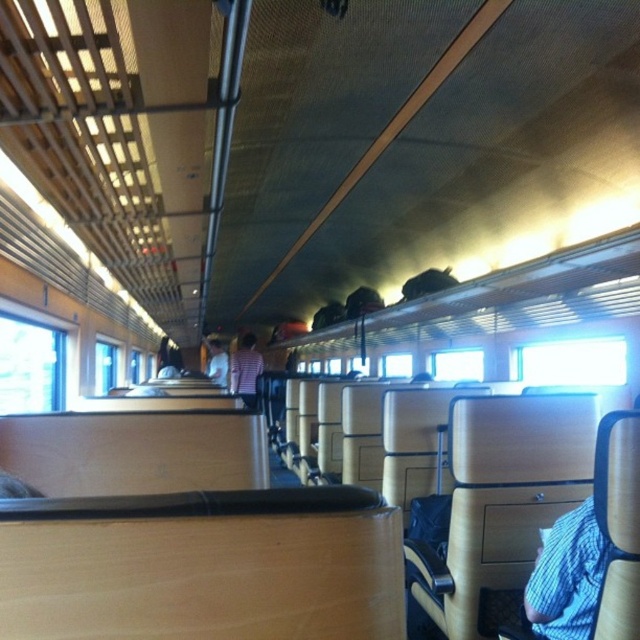
Is striped fabric shirt at center above white fabric shirt at center?

Indeed, striped fabric shirt at center is positioned over white fabric shirt at center.

Does striped fabric shirt at center have a lesser width compared to white fabric shirt at center?

Indeed, striped fabric shirt at center has a lesser width compared to white fabric shirt at center.

Is point (232, 355) farther from camera compared to point (221, 374)?

No, it is in front of (221, 374).

You are a GUI agent. You are given a task and a screenshot of the screen. Output one action in this format:
    pyautogui.click(x=<x>, y=<y>)
    Task: Click on the striped fabric shirt at center
    
    Given the screenshot: What is the action you would take?
    (244, 371)

Between point (586, 518) and point (211, 346), which one is positioned in front?

Positioned in front is point (586, 518).

Who is higher up, blue knitted sweater at lower right or white fabric shirt at center?

blue knitted sweater at lower right

Does point (529, 602) come farther from viewer compared to point (221, 372)?

No, it is not.

Image resolution: width=640 pixels, height=640 pixels. Identify the location of blue knitted sweater at lower right. (566, 577).

Is blue knitted sweater at lower right to the left of striped fabric shirt at center from the viewer's perspective?

In fact, blue knitted sweater at lower right is to the right of striped fabric shirt at center.

Who is more distant from viewer, (548, 593) or (253, 348)?

The point (253, 348) is more distant.

Locate an element on the screen. Image resolution: width=640 pixels, height=640 pixels. blue knitted sweater at lower right is located at coordinates (566, 577).